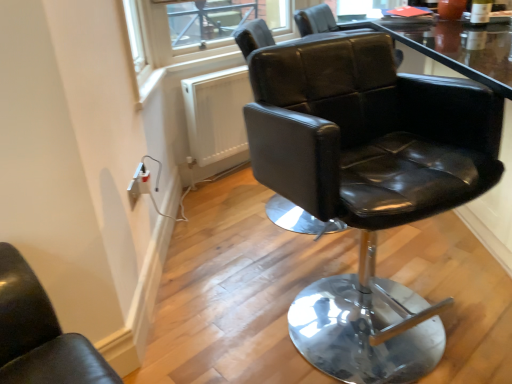
Question: From the image's perspective, is black leather chair at center above transparent glass window screen at upper center?

Choices:
 (A) yes
 (B) no

Answer: (B)

Question: Is transparent glass window screen at upper center located within black leather chair at center?

Choices:
 (A) yes
 (B) no

Answer: (B)

Question: Does black leather chair at center come in front of transparent glass window screen at upper center?

Choices:
 (A) no
 (B) yes

Answer: (B)

Question: Is black leather chair at center facing towards transparent glass window screen at upper center?

Choices:
 (A) yes
 (B) no

Answer: (B)

Question: Is black leather chair at center to the left of transparent glass window screen at upper center from the viewer's perspective?

Choices:
 (A) yes
 (B) no

Answer: (B)

Question: From a real-world perspective, is black leather chair at center under transparent glass window screen at upper center?

Choices:
 (A) yes
 (B) no

Answer: (A)

Question: Is transparent glass window screen at upper center outside of black leather chair at center?

Choices:
 (A) no
 (B) yes

Answer: (B)

Question: Is transparent glass window screen at upper center thinner than black leather chair at center?

Choices:
 (A) yes
 (B) no

Answer: (A)

Question: From the image's perspective, does transparent glass window screen at upper center appear higher than black leather chair at center?

Choices:
 (A) yes
 (B) no

Answer: (A)

Question: Does transparent glass window screen at upper center appear on the right side of black leather chair at center?

Choices:
 (A) no
 (B) yes

Answer: (A)

Question: Considering the relative positions of transparent glass window screen at upper center and black leather chair at center in the image provided, is transparent glass window screen at upper center behind black leather chair at center?

Choices:
 (A) no
 (B) yes

Answer: (B)

Question: Is black leather chair at center at the back of transparent glass window screen at upper center?

Choices:
 (A) no
 (B) yes

Answer: (A)

Question: From the image's perspective, relative to black leather chair at center, is transparent glass window screen at upper center above or below?

Choices:
 (A) above
 (B) below

Answer: (A)